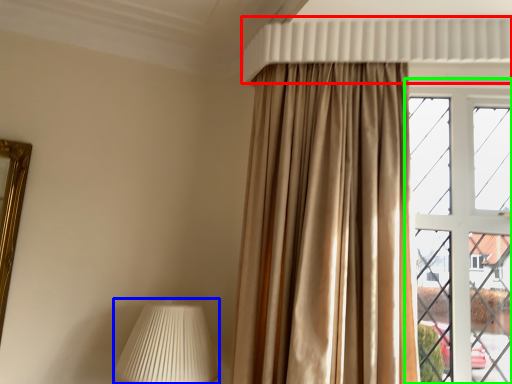
Question: Based on their relative distances, which object is nearer to shutter (highlighted by a red box)? Choose from table lamp (highlighted by a blue box) and window (highlighted by a green box).

Choices:
 (A) table lamp
 (B) window

Answer: (B)